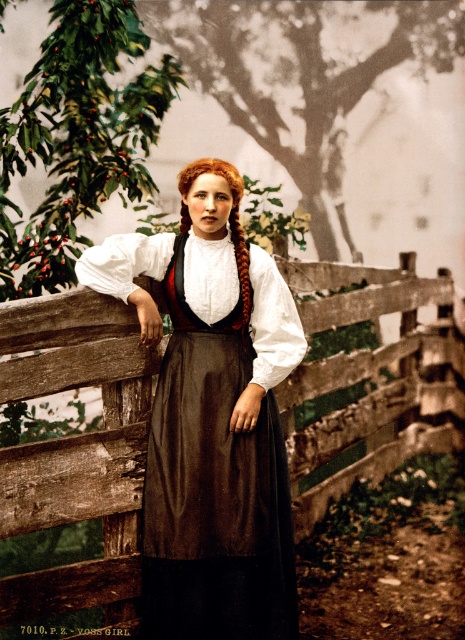
Is wooden fence at center to the left of brown satin dress at center from the viewer's perspective?

Incorrect, wooden fence at center is not on the left side of brown satin dress at center.

Between wooden fence at center and brown satin dress at center, which one has more height?

Standing taller between the two is brown satin dress at center.

Is point (298, 436) farther from viewer compared to point (280, 444)?

Yes, it is.

The width and height of the screenshot is (465, 640). Identify the location of wooden fence at center. (78, 452).